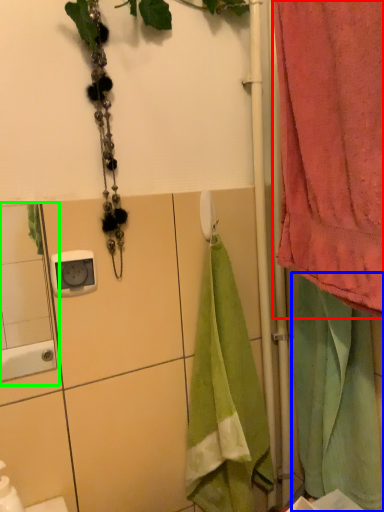
Question: Estimate the real-world distances between objects in this image. Which object is farther from curtain (highlighted by a red box), beach towel (highlighted by a blue box) or mirror (highlighted by a green box)?

Choices:
 (A) beach towel
 (B) mirror

Answer: (B)